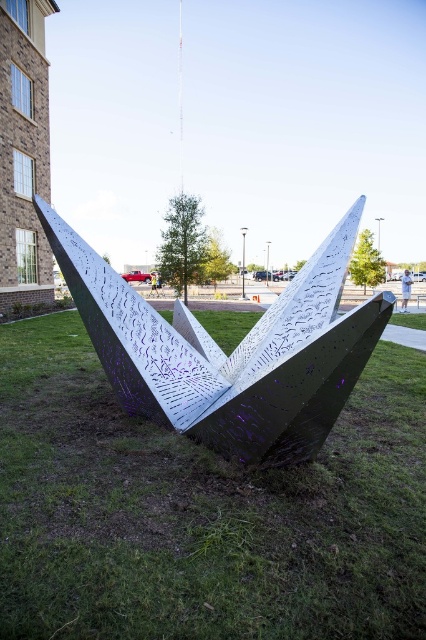
Is metallic grass at center to the right of metallic silver sculpture at center from the viewer's perspective?

Incorrect, metallic grass at center is not on the right side of metallic silver sculpture at center.

Can you confirm if metallic grass at center is thinner than metallic silver sculpture at center?

Incorrect, metallic grass at center's width is not less than metallic silver sculpture at center's.

Is point (104, 449) behind point (131, 317)?

No, (104, 449) is closer to viewer.

This screenshot has width=426, height=640. In order to click on metallic grass at center in this screenshot , I will do (x=201, y=512).